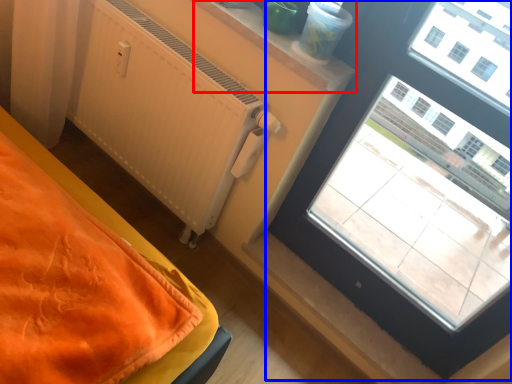
Question: Which point is closer to the camera, window sill (highlighted by a red box) or window (highlighted by a blue box)?

Choices:
 (A) window sill
 (B) window

Answer: (B)